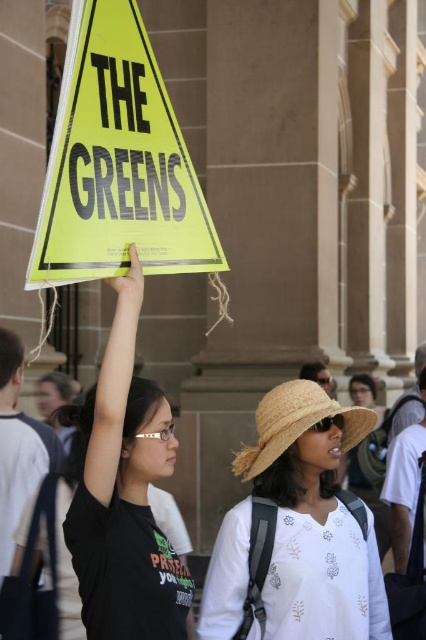
Is yellow paper sign at upper left thinner than black matte t-shirt at upper left?

No.

Find the location of a particular element. The width and height of the screenshot is (426, 640). yellow paper sign at upper left is located at coordinates (117, 163).

At what (x,y) coordinates should I click in order to perform the action: click on yellow paper sign at upper left. Please return your answer as a coordinate pair (x, y). This screenshot has width=426, height=640. Looking at the image, I should click on (117, 163).

Does straw hat at center have a greater height compared to strawmaterial/texturehat at center?

Yes.

Does straw hat at center have a larger size compared to strawmaterial/texturehat at center?

Actually, straw hat at center might be smaller than strawmaterial/texturehat at center.

Does point (340, 440) come behind point (307, 390)?

Yes, it is.

Find the location of a particular element. Image resolution: width=426 pixels, height=640 pixels. straw hat at center is located at coordinates (313, 518).

Can you confirm if black matte t-shirt at upper left is positioned below strawmaterial/texturehat at center?

No, black matte t-shirt at upper left is not below strawmaterial/texturehat at center.

Is black matte t-shirt at upper left shorter than strawmaterial/texturehat at center?

No, black matte t-shirt at upper left is not shorter than strawmaterial/texturehat at center.

Who is more distant from viewer, (92, 529) or (288, 406)?

Positioned behind is point (288, 406).

The image size is (426, 640). In order to click on black matte t-shirt at upper left in this screenshot , I will do `click(124, 493)`.